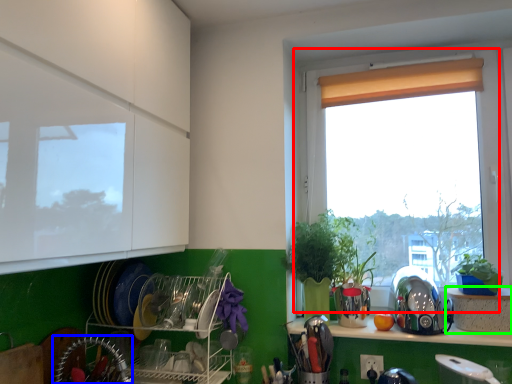
Question: Which object is the farthest from window (highlighted by a red box)? Choose among these: appliance (highlighted by a blue box) or cabinetry (highlighted by a green box).

Choices:
 (A) appliance
 (B) cabinetry

Answer: (A)